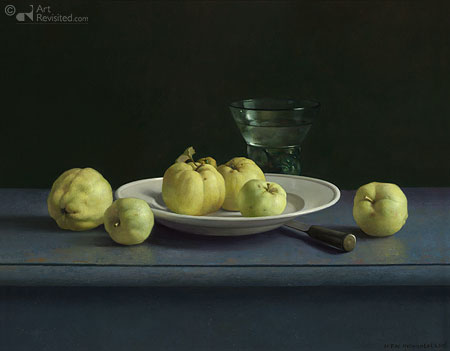
Locate an element on the screen. This screenshot has width=450, height=351. plate is located at coordinates (262, 215).